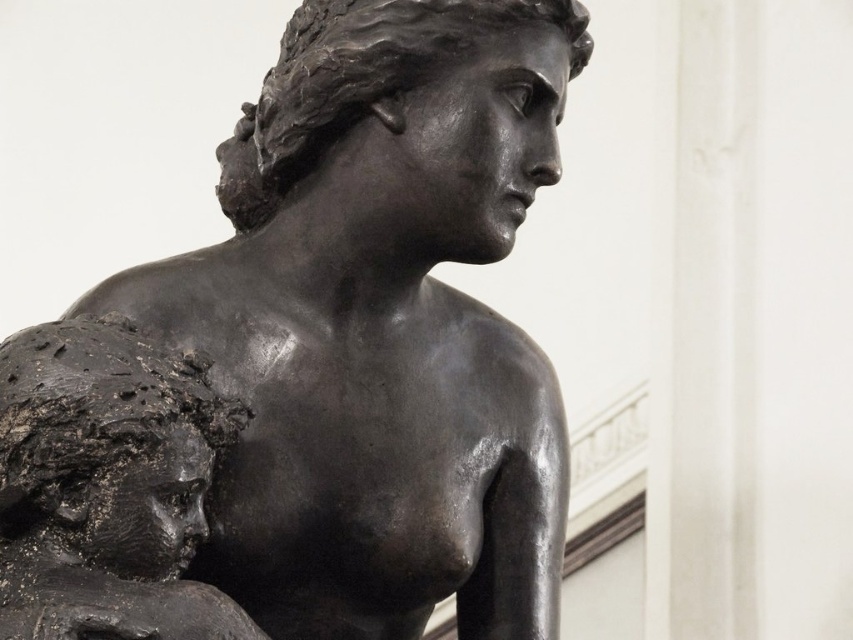
Question: Among these points, which one is farthest from the camera?

Choices:
 (A) (105, 365)
 (B) (41, 456)

Answer: (A)

Question: Can you confirm if matte black statue at center is thinner than matte black bust at left?

Choices:
 (A) yes
 (B) no

Answer: (B)

Question: Which of the following is the closest to the observer?

Choices:
 (A) matte black bust at left
 (B) matte black statue at center

Answer: (A)

Question: Does matte black statue at center have a smaller size compared to matte black bust at left?

Choices:
 (A) no
 (B) yes

Answer: (A)

Question: Does matte black statue at center come behind matte black bust at left?

Choices:
 (A) yes
 (B) no

Answer: (A)

Question: Which object appears farthest from the camera in this image?

Choices:
 (A) matte black bust at left
 (B) matte black statue at center

Answer: (B)